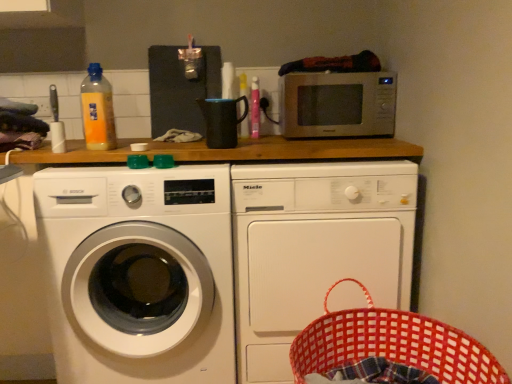
Question: Is white glossy washing machine at left, arranged as the first washing machine when viewed from the left, inside or outside of translucent plastic bottle at upper center, the first bottle from the back?

Choices:
 (A) inside
 (B) outside

Answer: (B)

Question: Is white glossy washing machine at left, the 2th washing machine from the right, bigger or smaller than translucent plastic bottle at upper center, marked as the first bottle in a right-to-left arrangement?

Choices:
 (A) small
 (B) big

Answer: (B)

Question: Which of these objects is positioned closest to the yellow translucent bottle at upper left, which is counted as the first bottle, starting from the left?

Choices:
 (A) satin silver microwave at upper center
 (B) white glossy washing machine at left, the 2th washing machine from the right
 (C) white matte washing machine at center, which appears as the first washing machine when viewed from the right
 (D) red woven basket at lower right
 (E) translucent plastic bottle at upper center, the first bottle from the back

Answer: (B)

Question: Which of these objects is positioned closest to the red woven basket at lower right?

Choices:
 (A) satin silver microwave at upper center
 (B) white glossy washing machine at left, arranged as the first washing machine when viewed from the left
 (C) yellow translucent bottle at upper left, which is counted as the first bottle, starting from the left
 (D) white matte washing machine at center, the 2th washing machine positioned from the left
 (E) translucent plastic bottle at upper center, the first bottle from the back

Answer: (D)